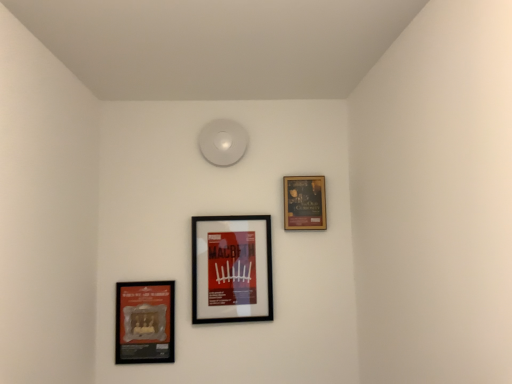
Question: Is black matte picture frame at center, the second picture frame from the right, outside wooden frame at upper right, acting as the first picture frame starting from the right?

Choices:
 (A) yes
 (B) no

Answer: (A)

Question: Can you confirm if black matte picture frame at center, the 2th picture frame from the left, is smaller than wooden frame at upper right, marked as the third picture frame in a left-to-right arrangement?

Choices:
 (A) yes
 (B) no

Answer: (B)

Question: From a real-world perspective, is black matte picture frame at center, the 2th picture frame from the left, over wooden frame at upper right, marked as the third picture frame in a left-to-right arrangement?

Choices:
 (A) no
 (B) yes

Answer: (A)

Question: Is black matte picture frame at center, the 2th picture frame from the left, shorter than wooden frame at upper right, acting as the first picture frame starting from the right?

Choices:
 (A) no
 (B) yes

Answer: (A)

Question: Is black matte picture frame at center, the second picture frame from the right, further to camera compared to wooden frame at upper right, acting as the first picture frame starting from the right?

Choices:
 (A) no
 (B) yes

Answer: (A)

Question: Is wooden frame at upper right, acting as the first picture frame starting from the right, spatially inside matte black picture frame at lower left, positioned as the 3th picture frame in right-to-left order, or outside of it?

Choices:
 (A) outside
 (B) inside

Answer: (A)

Question: In terms of width, does wooden frame at upper right, acting as the first picture frame starting from the right, look wider or thinner when compared to matte black picture frame at lower left, the first picture frame when ordered from left to right?

Choices:
 (A) thin
 (B) wide

Answer: (B)

Question: Does point click(x=287, y=183) appear closer or farther from the camera than point click(x=165, y=311)?

Choices:
 (A) closer
 (B) farther

Answer: (B)

Question: From a real-world perspective, relative to matte black picture frame at lower left, positioned as the 3th picture frame in right-to-left order, is wooden frame at upper right, acting as the first picture frame starting from the right, vertically above or below?

Choices:
 (A) above
 (B) below

Answer: (A)

Question: From the image's perspective, is matte black picture frame at lower left, positioned as the 3th picture frame in right-to-left order, located above or below black matte picture frame at center, the second picture frame from the right?

Choices:
 (A) below
 (B) above

Answer: (A)

Question: Considering the positions of matte black picture frame at lower left, positioned as the 3th picture frame in right-to-left order, and black matte picture frame at center, the second picture frame from the right, in the image, is matte black picture frame at lower left, positioned as the 3th picture frame in right-to-left order, taller or shorter than black matte picture frame at center, the second picture frame from the right,?

Choices:
 (A) short
 (B) tall

Answer: (A)

Question: From a real-world perspective, relative to black matte picture frame at center, the second picture frame from the right, is matte black picture frame at lower left, positioned as the 3th picture frame in right-to-left order, vertically above or below?

Choices:
 (A) above
 (B) below

Answer: (B)

Question: Is point (135, 324) positioned closer to the camera than point (220, 306)?

Choices:
 (A) farther
 (B) closer

Answer: (B)

Question: Is black matte picture frame at center, the second picture frame from the right, taller or shorter than matte black picture frame at lower left, positioned as the 3th picture frame in right-to-left order?

Choices:
 (A) short
 (B) tall

Answer: (B)

Question: Is black matte picture frame at center, the 2th picture frame from the left, to the left or to the right of matte black picture frame at lower left, positioned as the 3th picture frame in right-to-left order, in the image?

Choices:
 (A) left
 (B) right

Answer: (B)